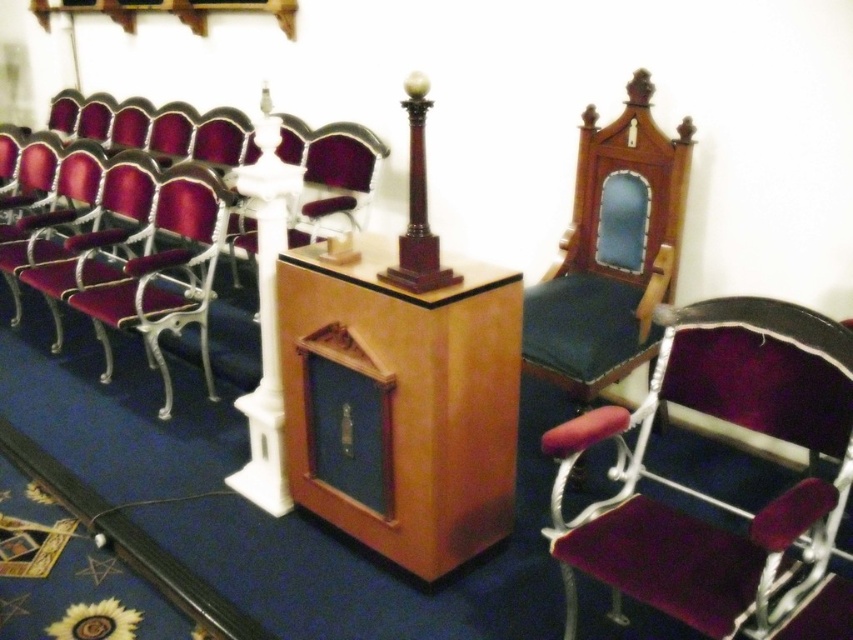
Question: Among these objects, which one is nearest to the camera?

Choices:
 (A) mahogany wood column at center
 (B) white glossy column at center
 (C) wooden podium at center
 (D) velvet purple armchair at center

Answer: (D)

Question: Among these objects, which one is farthest from the camera?

Choices:
 (A) white glossy column at center
 (B) wooden podium at center
 (C) wooden armchair at center

Answer: (C)

Question: Can you confirm if wooden armchair at center is positioned to the left of metallic silver armchair at left?

Choices:
 (A) no
 (B) yes

Answer: (A)

Question: Is wooden armchair at center bigger than mahogany wood column at center?

Choices:
 (A) no
 (B) yes

Answer: (B)

Question: Considering the relative positions of wooden podium at center and metallic silver armchair at left in the image provided, where is wooden podium at center located with respect to metallic silver armchair at left?

Choices:
 (A) left
 (B) right

Answer: (B)

Question: Which of these objects is positioned farthest from the metallic silver armchair at left?

Choices:
 (A) wooden armchair at center
 (B) wooden podium at center
 (C) white glossy column at center
 (D) velvet purple armchair at center

Answer: (D)